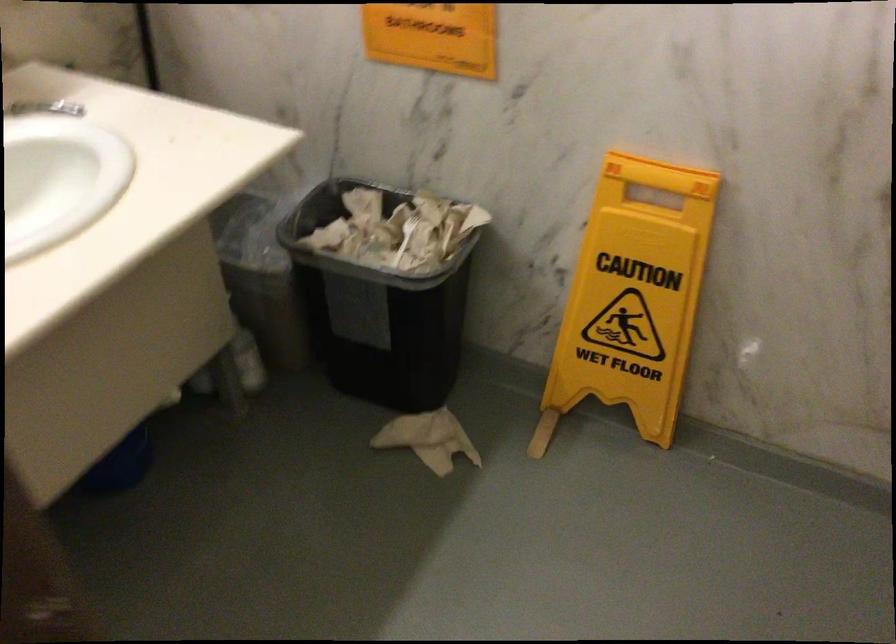
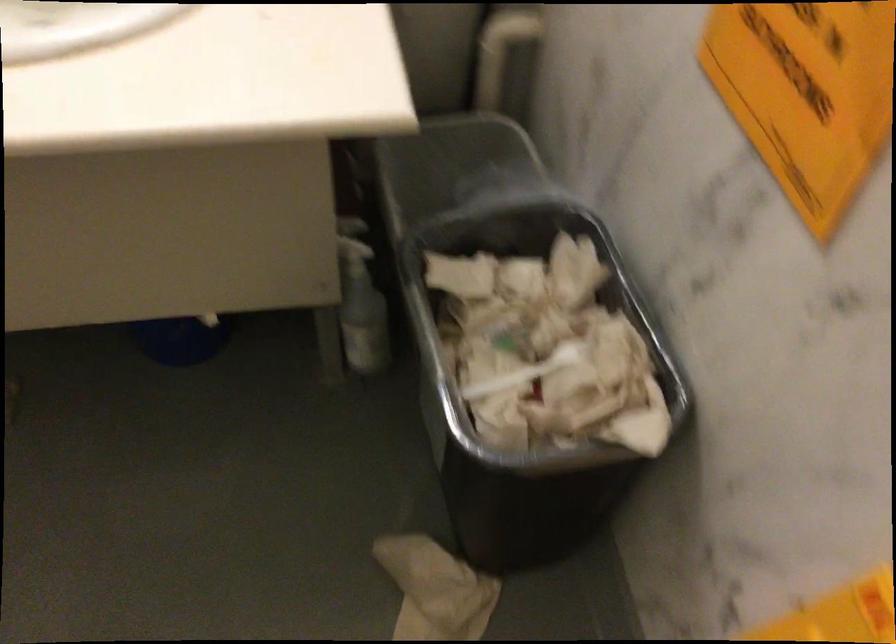
Where in the second image is the point corresponding to (x=242, y=339) from the first image?

(360, 303)